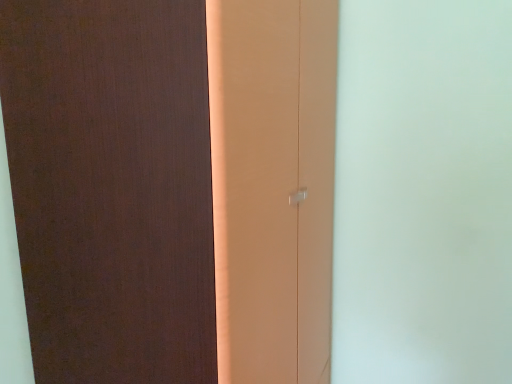
The image size is (512, 384). What are the coordinates of `matte wood door at center` in the screenshot? It's located at (173, 186).

Describe the element at coordinates (173, 186) in the screenshot. I see `matte wood door at center` at that location.

Locate an element on the screen. matte wood door at center is located at coordinates (173, 186).